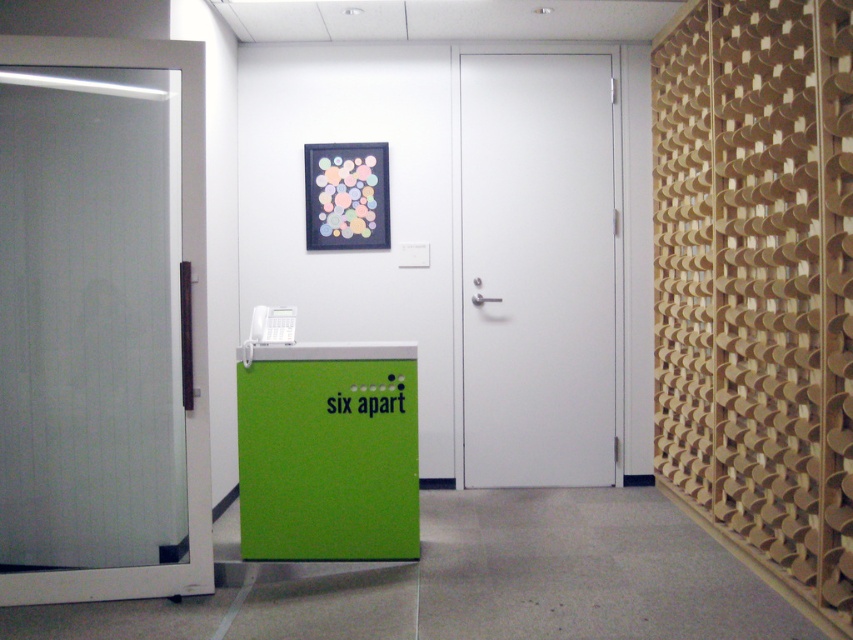
You are standing at the center of the office hallway. There is a point marked at coordinates [757,285]. What object is located at this point?

The point at coordinates [757,285] indicates wooden slats at right.

You are standing in the office hallway and want to hang a new picture frame between the wooden slats at right and the green matte locker at center. Which object should you place the frame closer to if you want it to be higher up?

The wooden slats at right is above the green matte locker at center, so placing the frame closer to the wooden slats at right will position it higher up.